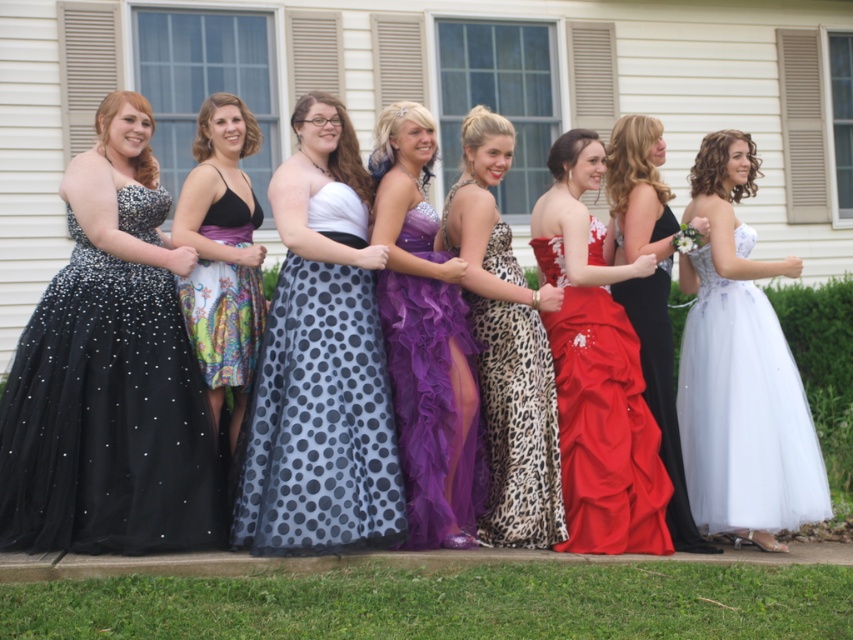
Does polka dot tulle dress at center have a lesser width compared to red satin dress at center?

No, polka dot tulle dress at center is not thinner than red satin dress at center.

This screenshot has width=853, height=640. What do you see at coordinates (320, 362) in the screenshot?
I see `polka dot tulle dress at center` at bounding box center [320, 362].

At what (x,y) coordinates should I click in order to perform the action: click on polka dot tulle dress at center. Please return your answer as a coordinate pair (x, y). The height and width of the screenshot is (640, 853). Looking at the image, I should click on (320, 362).

Is black sequined dress at left closer to the viewer compared to purple tulle dress at center?

Yes, it is in front of purple tulle dress at center.

Who is shorter, black sequined dress at left or purple tulle dress at center?

purple tulle dress at center is shorter.

Which is behind, point (9, 388) or point (434, 493)?

Point (9, 388)

Locate an element on the screen. The width and height of the screenshot is (853, 640). black sequined dress at left is located at coordinates tap(109, 376).

Who is higher up, purple tulle dress at center or matte black dress at center?

purple tulle dress at center is higher up.

Is purple tulle dress at center above matte black dress at center?

Correct, purple tulle dress at center is located above matte black dress at center.

Is point (445, 307) farther from viewer compared to point (636, 188)?

No, it is in front of (636, 188).

In order to click on purple tulle dress at center in this screenshot , I will do `click(424, 337)`.